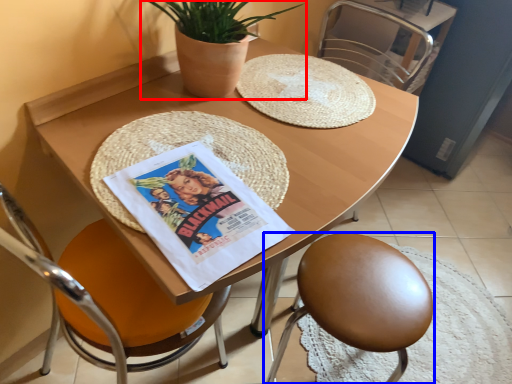
Question: Which of the following is the farthest to the observer, houseplant (highlighted by a red box) or chair (highlighted by a blue box)?

Choices:
 (A) houseplant
 (B) chair

Answer: (B)